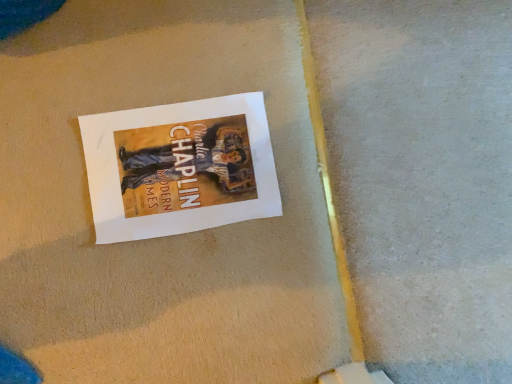
Question: Should I look upward or downward to see matte paper poster at center?

Choices:
 (A) down
 (B) up

Answer: (B)